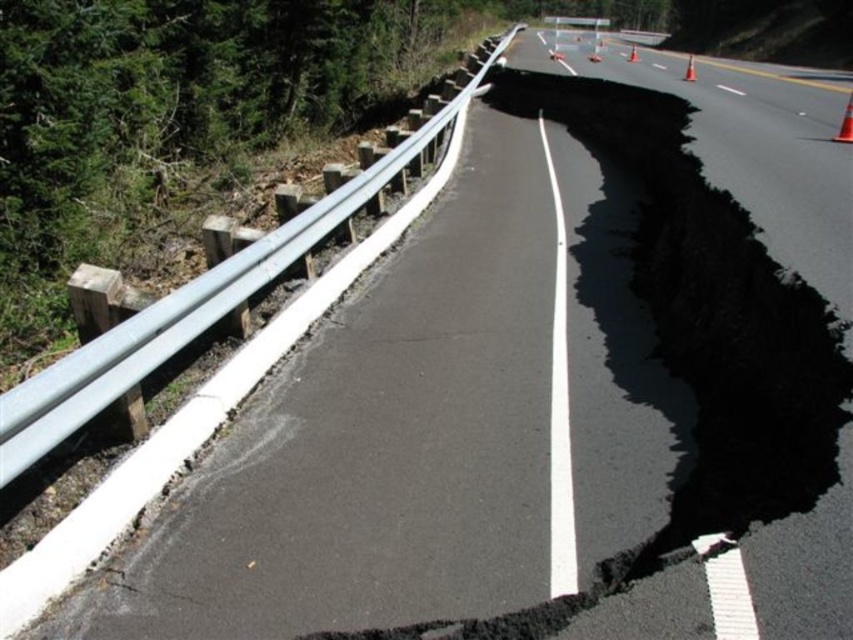
Which of these two, orange cone at right or orange plastic traffic cone at upper right, stands taller?

orange plastic traffic cone at upper right is taller.

Is orange cone at right smaller than orange plastic traffic cone at upper right?

Correct, orange cone at right occupies less space than orange plastic traffic cone at upper right.

You are a GUI agent. You are given a task and a screenshot of the screen. Output one action in this format:
    pyautogui.click(x=<x>, y=<y>)
    Task: Click on the orange cone at right
    Image resolution: width=853 pixels, height=640 pixels.
    Given the screenshot: What is the action you would take?
    pyautogui.click(x=845, y=124)

Identify the location of orange cone at right. The width and height of the screenshot is (853, 640). (845, 124).

Can you confirm if orange cone at right is taller than orange plastic cone at upper center?

No.

Does orange cone at right have a smaller size compared to orange plastic cone at upper center?

Indeed, orange cone at right has a smaller size compared to orange plastic cone at upper center.

Is point (844, 109) less distant than point (550, 51)?

Yes, it is in front of point (550, 51).

You are a GUI agent. You are given a task and a screenshot of the screen. Output one action in this format:
    pyautogui.click(x=<x>, y=<y>)
    Task: Click on the orange cone at right
    This screenshot has width=853, height=640.
    Given the screenshot: What is the action you would take?
    pyautogui.click(x=845, y=124)

Is orange plastic traffic cone at upper right wider than orange plastic cone at upper center?

Yes.

Does orange plastic traffic cone at upper right lie in front of orange plastic cone at upper center?

Yes, orange plastic traffic cone at upper right is in front of orange plastic cone at upper center.

Find the location of a particular element. The height and width of the screenshot is (640, 853). orange plastic traffic cone at upper right is located at coordinates (595, 52).